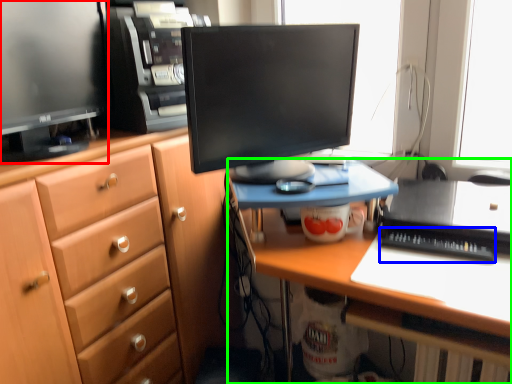
Question: Which is nearer to the computer monitor (highlighted by a red box)? laptop keyboard (highlighted by a blue box) or desk (highlighted by a green box).

Choices:
 (A) laptop keyboard
 (B) desk

Answer: (B)